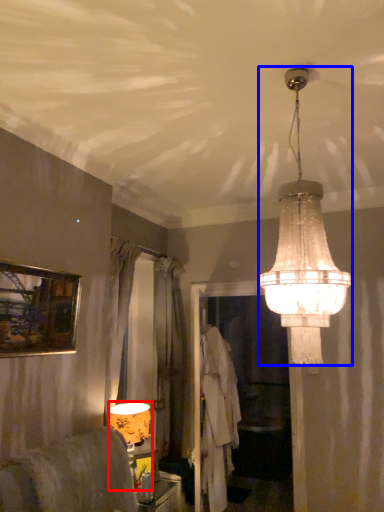
Question: Which point is closer to the camera, lamp (highlighted by a red box) or lamp (highlighted by a blue box)?

Choices:
 (A) lamp
 (B) lamp

Answer: (B)